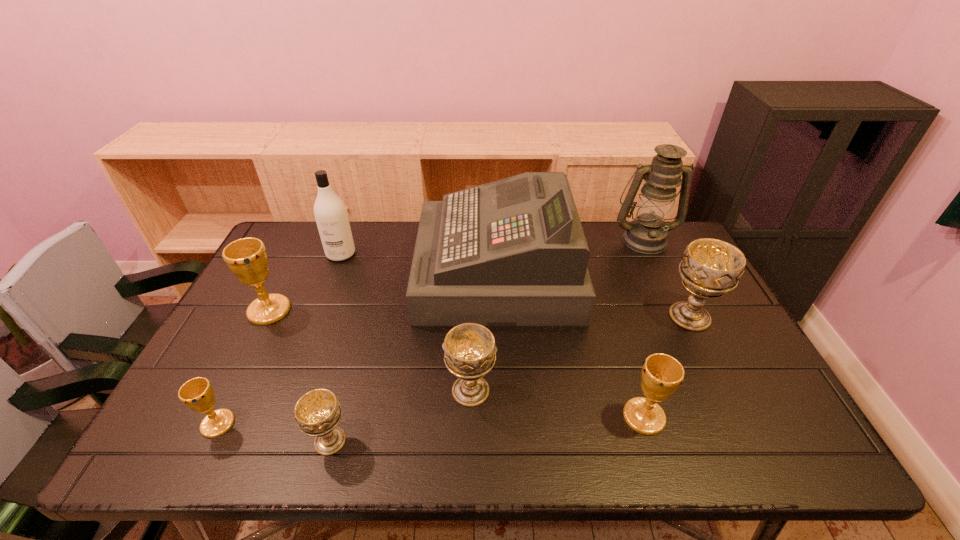
Locate an element on the screen. The image size is (960, 540). vacant space positioned 0.130m on the front of the rightmost white chalice is located at coordinates (719, 375).

You are a GUI agent. You are given a task and a screenshot of the screen. Output one action in this format:
    pyautogui.click(x=<x>, y=<y>)
    Task: Click on the vacant space situated on the left of the second farthest white chalice
    
    Given the screenshot: What is the action you would take?
    pyautogui.click(x=334, y=390)

Where is `vacant space situated on the right of the third object from right to left`? vacant space situated on the right of the third object from right to left is located at coordinates (786, 417).

Locate an element on the screen. The image size is (960, 540). vacant region located 0.370m on the right of the smallest gold chalice is located at coordinates (396, 424).

Locate an element on the screen. This screenshot has width=960, height=540. vacant space positioned 0.050m on the left of the third chalice from left to right is located at coordinates (287, 441).

Find the location of a particular element. oil lamp situated at the far edge is located at coordinates (647, 234).

Image resolution: width=960 pixels, height=540 pixels. I want to click on cash register positioned at the far edge, so click(x=512, y=252).

In order to click on shampoo situated at the far edge in this screenshot , I will do `click(330, 213)`.

You are a GUI agent. You are given a task and a screenshot of the screen. Output one action in this format:
    pyautogui.click(x=<x>, y=<y>)
    Task: Click on the oil lamp present at the right edge
    The height and width of the screenshot is (540, 960).
    Given the screenshot: What is the action you would take?
    pyautogui.click(x=647, y=234)

What are the coordinates of `chalice that is at the right edge` in the screenshot? It's located at (710, 268).